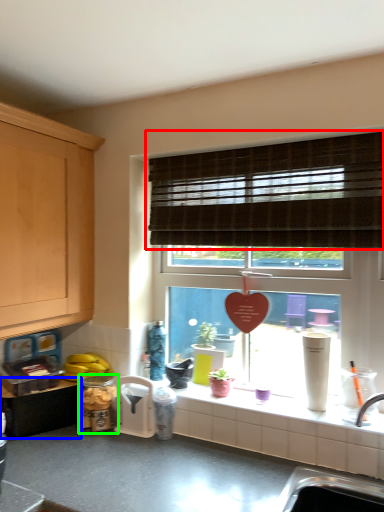
Question: Estimate the real-world distances between objects in this image. Which object is farther from window blind (highlighted by a red box), cabinetry (highlighted by a blue box) or appliance (highlighted by a green box)?

Choices:
 (A) cabinetry
 (B) appliance

Answer: (A)